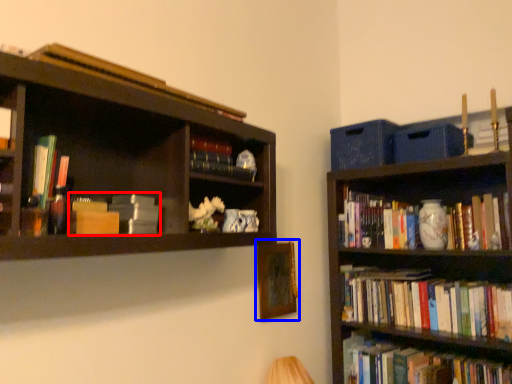
Question: Which point is closer to the camera, book (highlighted by a red box) or picture frame (highlighted by a blue box)?

Choices:
 (A) book
 (B) picture frame

Answer: (A)